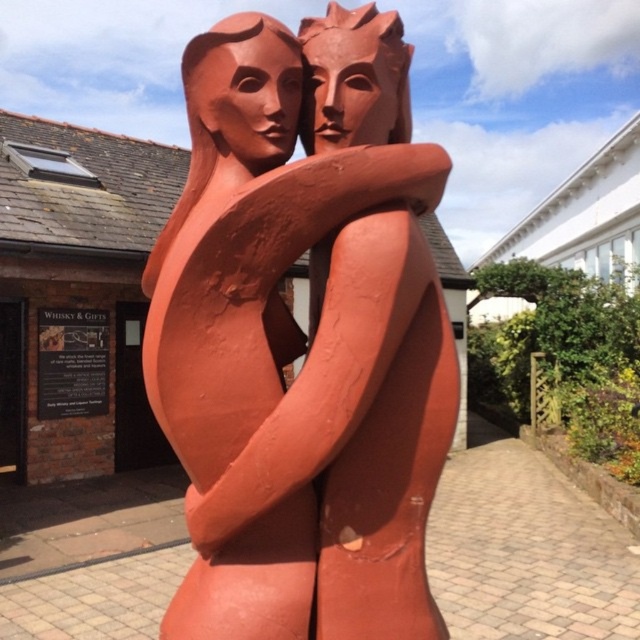
Question: Estimate the real-world distances between objects in this image. Which object is closer to the matte terracotta head at upper center?

Choices:
 (A) matte terracotta head at center
 (B) terracotta statue at center

Answer: (A)

Question: Can you confirm if matte terracotta head at center is smaller than matte terracotta head at upper center?

Choices:
 (A) yes
 (B) no

Answer: (B)

Question: Which of the following is the closest to the observer?

Choices:
 (A) (284, 35)
 (B) (307, 88)

Answer: (A)

Question: Which of the following is the closest to the observer?

Choices:
 (A) terracotta statue at center
 (B) matte terracotta head at upper center

Answer: (A)

Question: Does terracotta statue at center lie behind matte terracotta head at upper center?

Choices:
 (A) yes
 (B) no

Answer: (B)

Question: Observing the image, what is the correct spatial positioning of matte terracotta head at center in reference to matte terracotta head at upper center?

Choices:
 (A) below
 (B) above

Answer: (B)